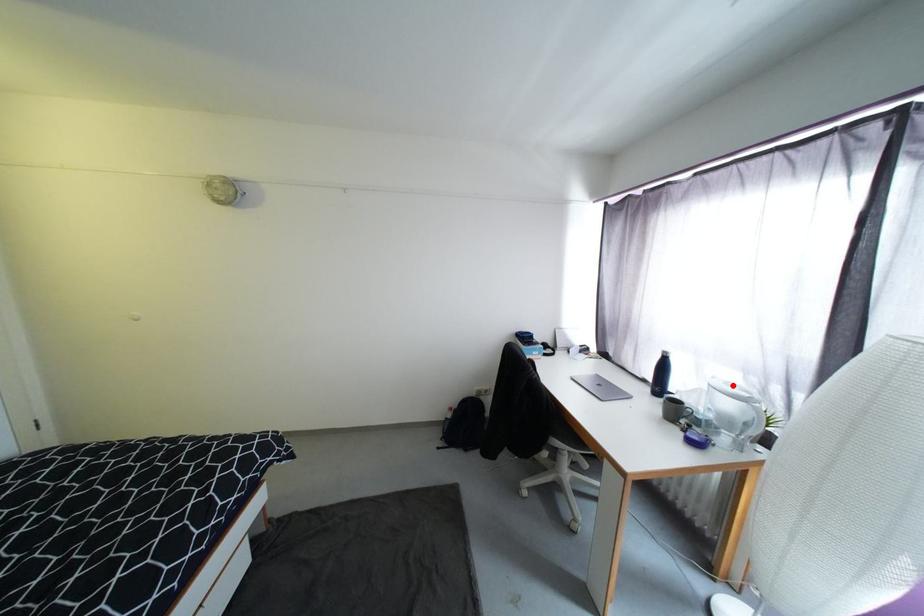
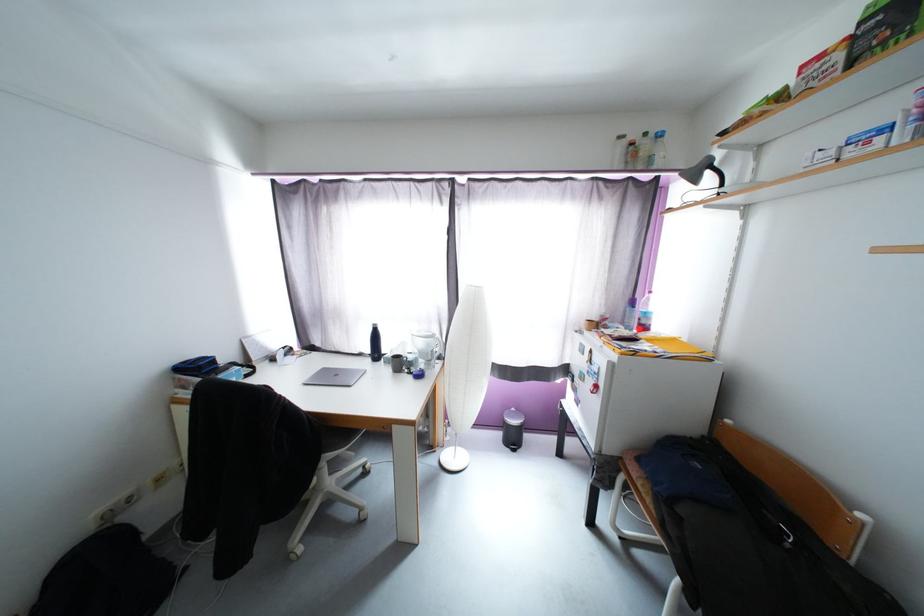
Question: I am providing you with two images of the same scene from different viewpoints. A red point is marked on the first image. At the location where the point appears in image 1, is it still visible in image 2?

Choices:
 (A) Yes
 (B) No

Answer: (A)